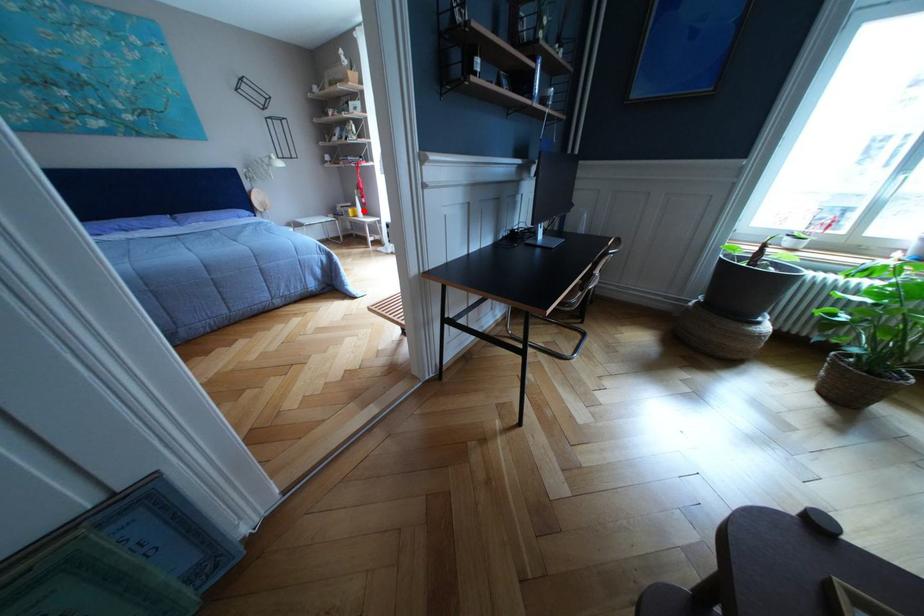
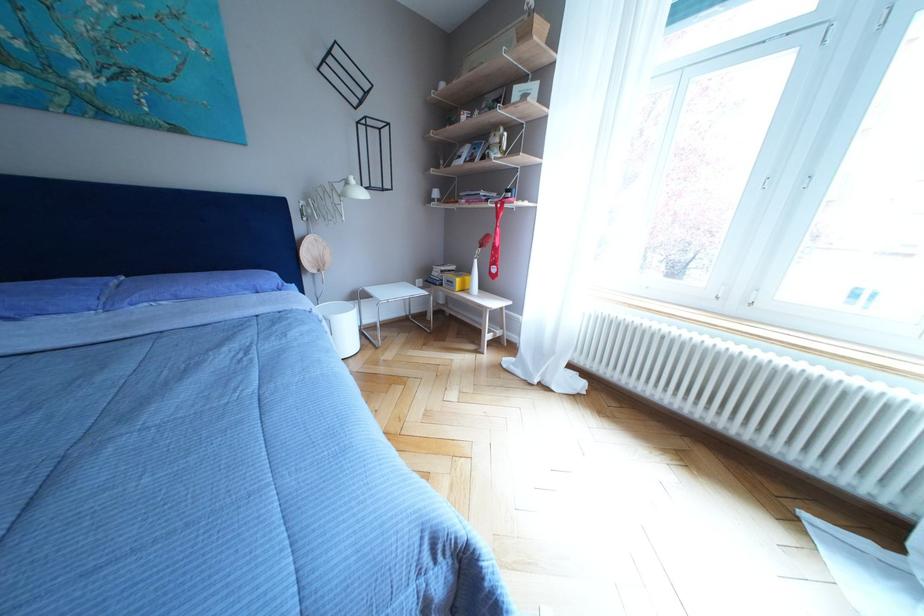
Where in the second image is the point corresponding to the highlighted location from the first image?

(473, 276)